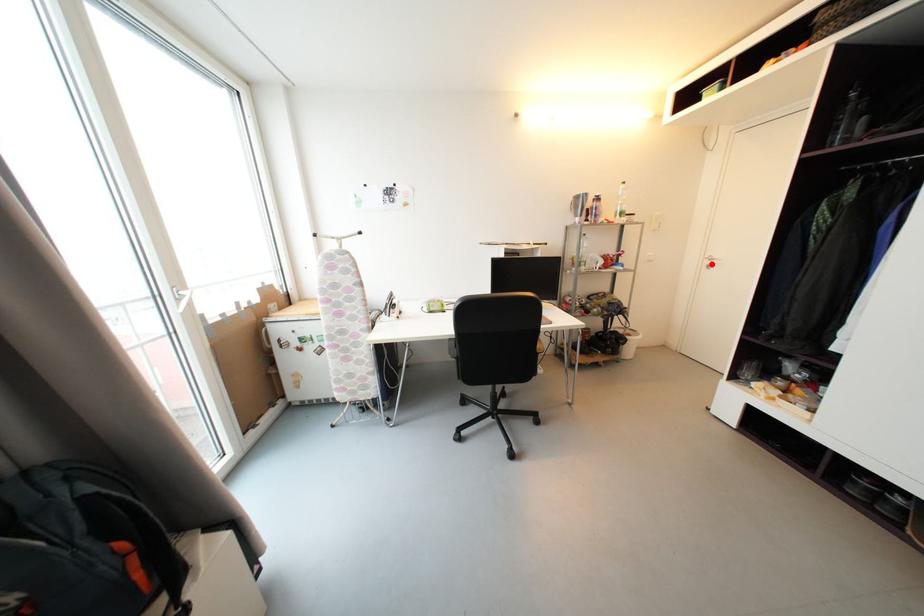
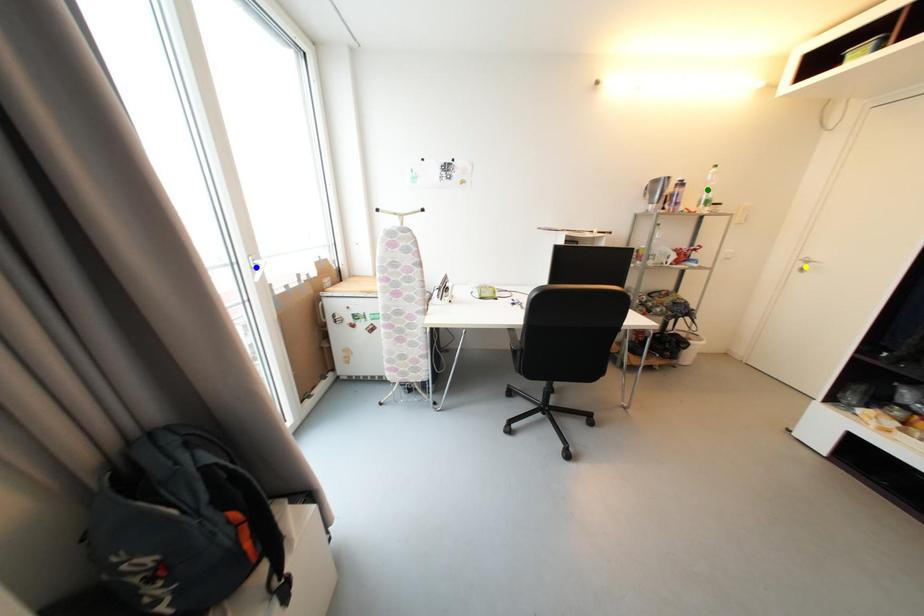
Question: I am providing you with two images of the same scene from different viewpoints. A red point is marked on the first image. You are given multiple points on the second image. Which mark in image 2 goes with the point in image 1?

Choices:
 (A) green point
 (B) blue point
 (C) yellow point

Answer: (C)